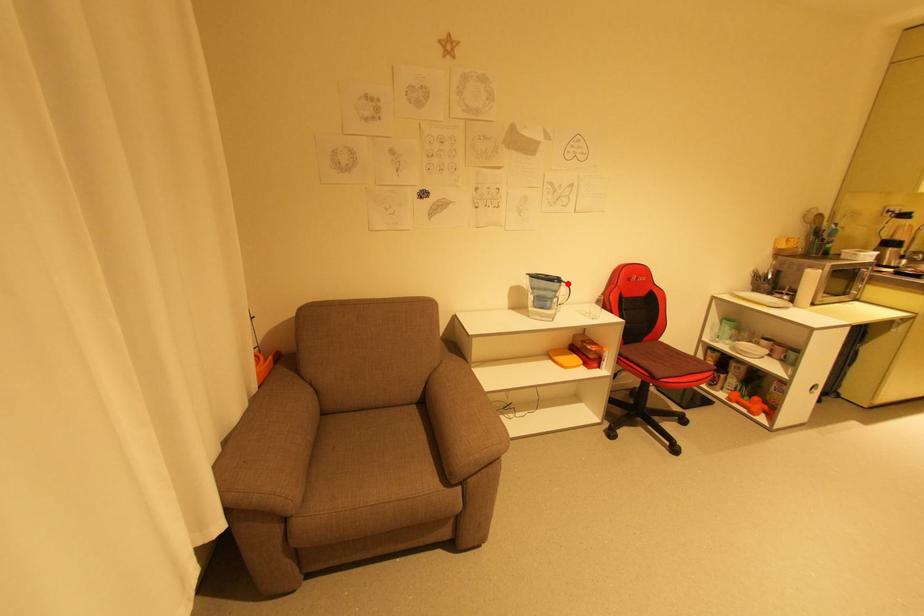
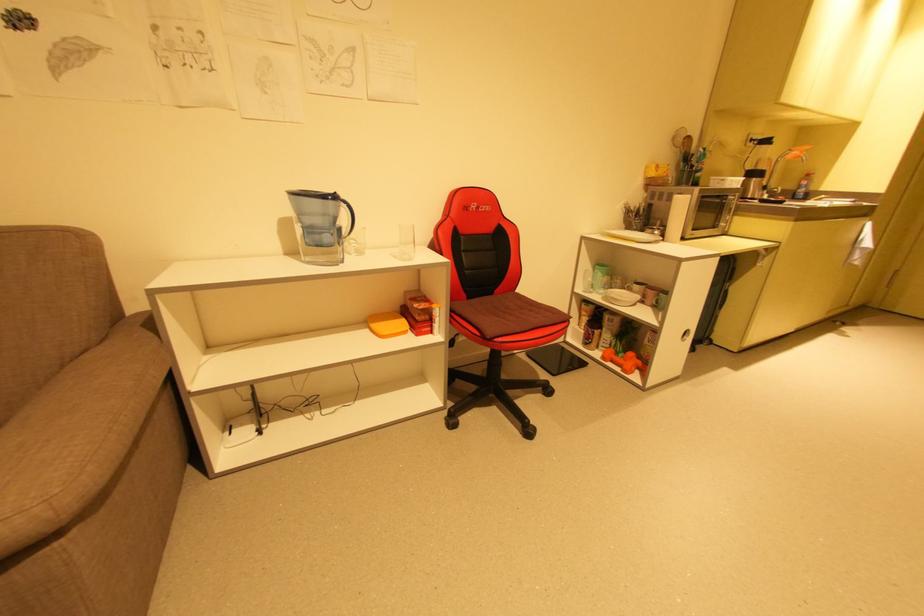
Locate, in the second image, the point that corresponds to the highlighted location in the first image.

(346, 204)